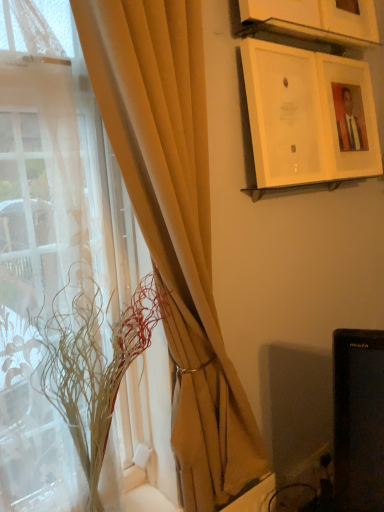
Question: Based on their positions, is matte beige curtain at left located to the left or right of matte white picture frame at upper right, acting as the second picture frame starting from the bottom?

Choices:
 (A) right
 (B) left

Answer: (B)

Question: Considering their positions, is matte beige curtain at left located in front of or behind matte white picture frame at upper right, acting as the second picture frame starting from the bottom?

Choices:
 (A) behind
 (B) front

Answer: (B)

Question: Which is farther from the matte white picture frame at upper right, arranged as the second picture frame when viewed from the top?

Choices:
 (A) translucent glass vase at left
 (B) wooden picture frame at upper center, which is counted as the 3th picture frame, starting from the bottom
 (C) white glossy picture frame at upper right, the third picture frame positioned from the top
 (D) translucent fabric at left
 (E) matte beige curtain at left

Answer: (A)

Question: Based on their relative distances, which object is farther from the white glossy picture frame at upper right, acting as the first picture frame starting from the bottom?

Choices:
 (A) matte beige curtain at left
 (B) translucent glass vase at left
 (C) translucent fabric at left
 (D) matte white picture frame at upper right, acting as the second picture frame starting from the bottom
 (E) wooden picture frame at upper center, which is counted as the 3th picture frame, starting from the bottom

Answer: (B)